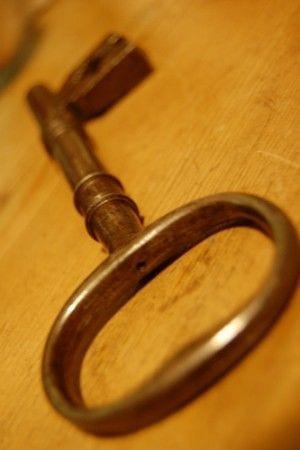
Identify the location of wood scratches. The image size is (300, 450). (197, 170), (280, 160).